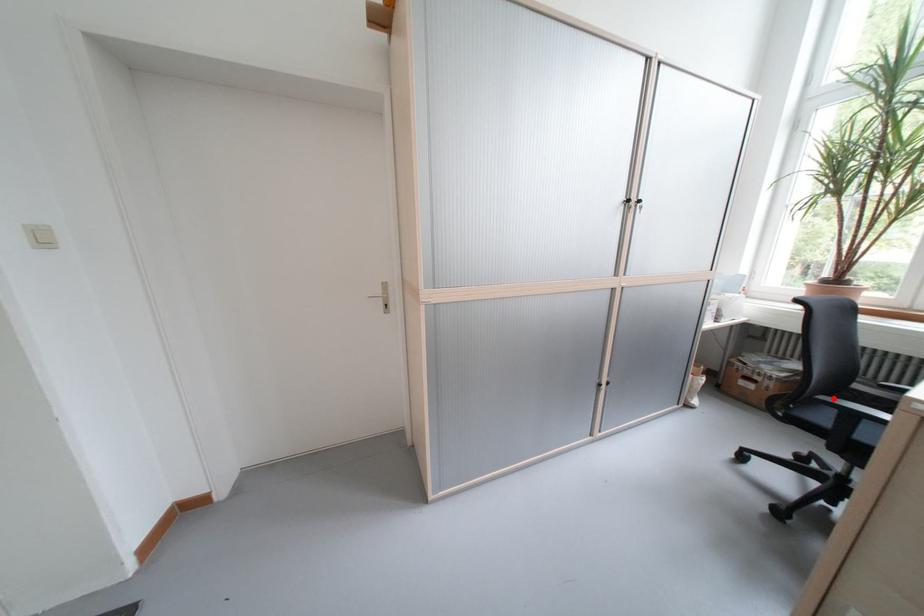
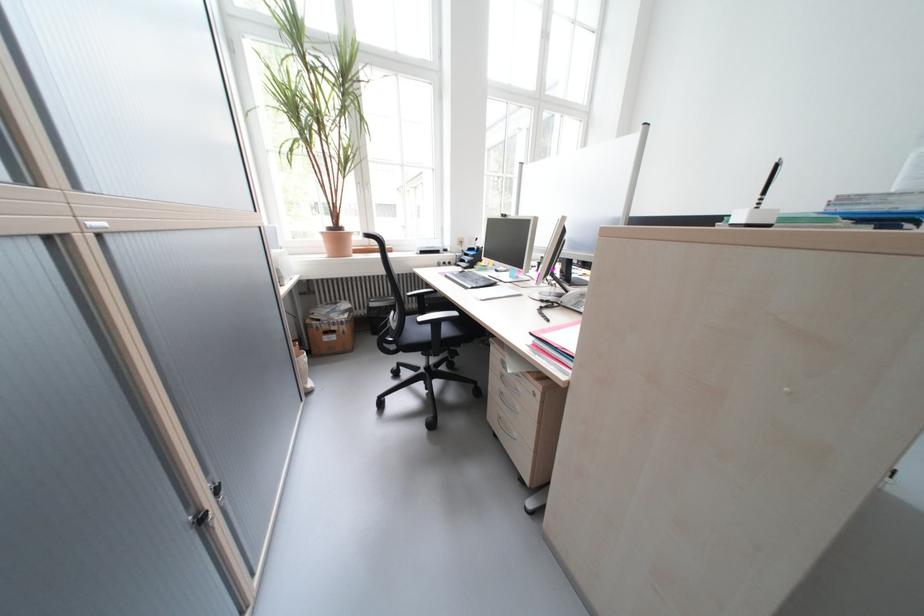
Question: I am providing you with two images of the same scene from different viewpoints. Given a red point in image1, look at the same physical point in image2. Is it:

Choices:
 (A) Closer to the viewpoint
 (B) Farther from the viewpoint

Answer: (A)